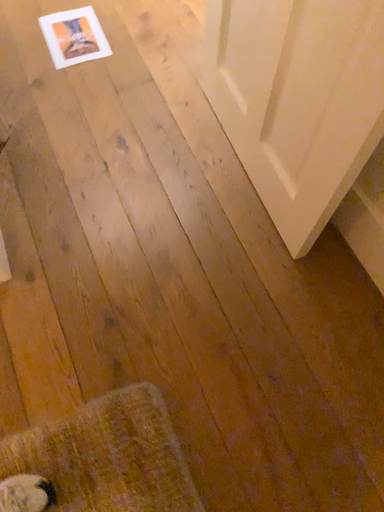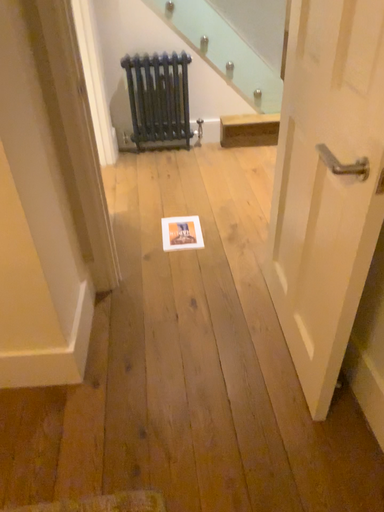
Question: Which way did the camera rotate in the video?

Choices:
 (A) rotated left
 (B) rotated right

Answer: (A)